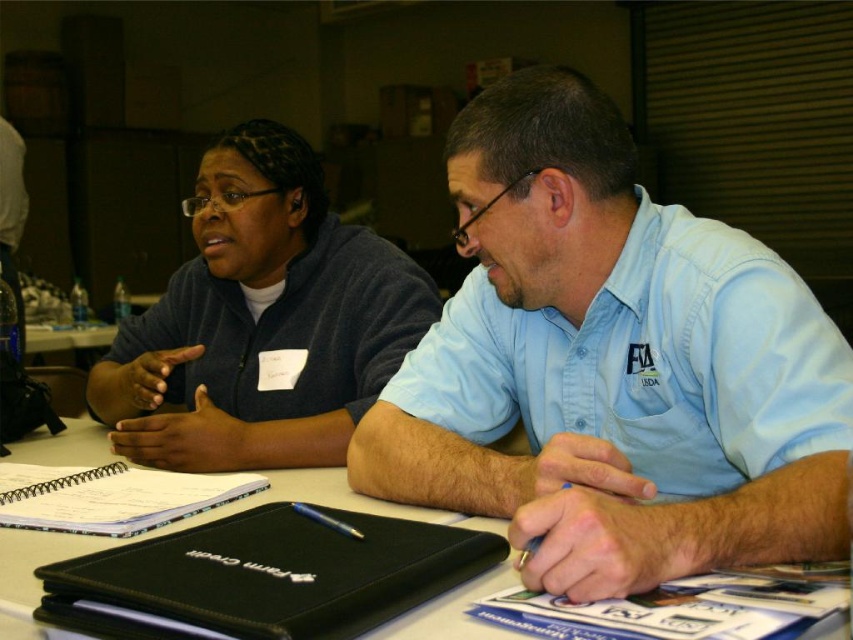
You are standing in front of the table where the two individuals are seated. There is a dark gray fleece jacket at upper left. Can you tell me the exact coordinates of where the dark gray fleece jacket is located?

The dark gray fleece jacket at upper left is located at point [260,321].